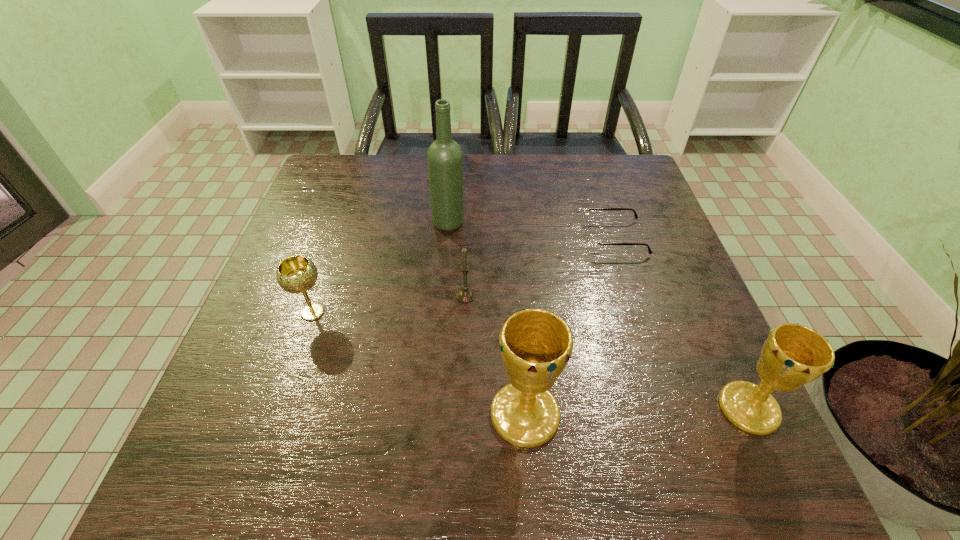
With all chalices evenly spaced, where should an extra chalice be placed on the left to continue the pattern? Please point out a vacant space. Please provide its 2D coordinates. Your answer should be formatted as a tuple, i.e. [(x, y)], where the tuple contains the x and y coordinates of a point satisfying the conditions above.

[(297, 420)]